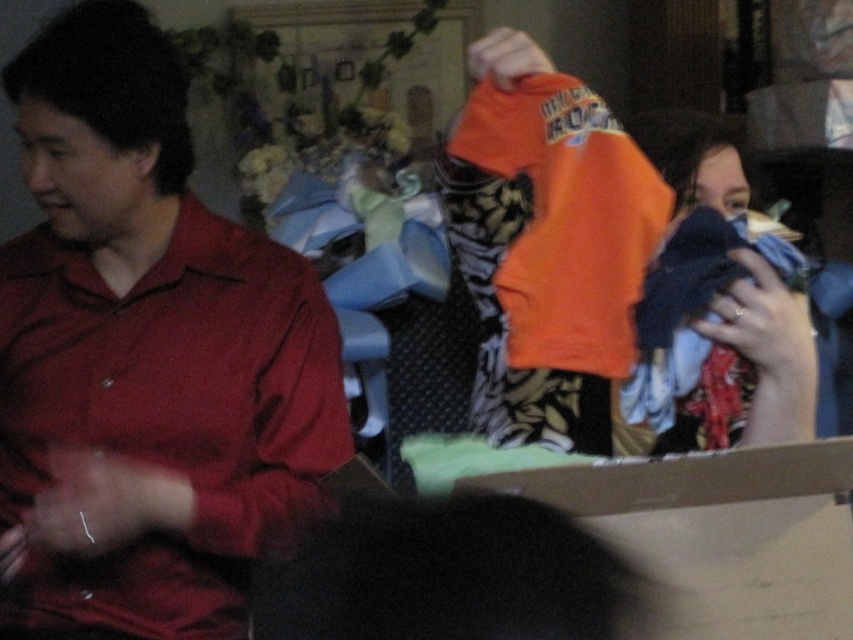
Question: Can you confirm if cardboard box at center is positioned to the right of orange cotton shirt at right?

Choices:
 (A) yes
 (B) no

Answer: (B)

Question: Which of the following is the closest to the observer?

Choices:
 (A) (755, 348)
 (B) (242, 477)

Answer: (A)

Question: Can you confirm if matte red shirt at left is positioned to the left of orange cotton shirt at right?

Choices:
 (A) yes
 (B) no

Answer: (A)

Question: Which is farther from the matte red shirt at left?

Choices:
 (A) orange cotton shirt at right
 (B) cardboard box at center

Answer: (A)

Question: Which of the following is the closest to the observer?

Choices:
 (A) (143, 547)
 (B) (732, 550)
 (C) (637, 435)

Answer: (B)

Question: Does matte red shirt at left have a larger size compared to cardboard box at center?

Choices:
 (A) no
 (B) yes

Answer: (B)